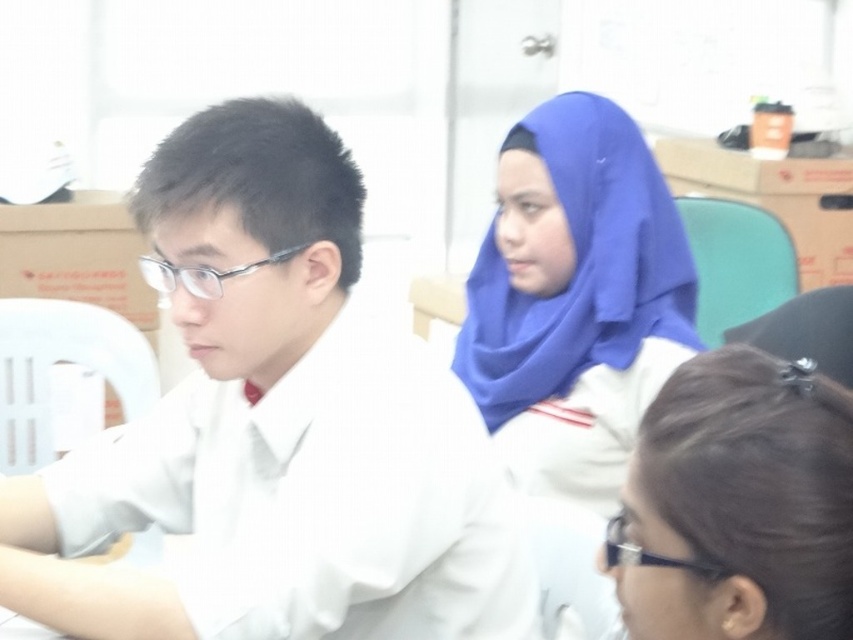
Question: Can you confirm if brown hair at lower right is bigger than blue fabric veil at upper center?

Choices:
 (A) yes
 (B) no

Answer: (B)

Question: Which of the following is the closest to the observer?

Choices:
 (A) (605, 324)
 (B) (730, 444)
 (C) (270, 221)

Answer: (B)

Question: Is brown hair at lower right above blue fabric veil at upper center?

Choices:
 (A) yes
 (B) no

Answer: (B)

Question: Does white matte shirt at left appear on the left side of brown hair at lower right?

Choices:
 (A) yes
 (B) no

Answer: (A)

Question: Which object is positioned farthest from the blue fabric veil at upper center?

Choices:
 (A) white matte shirt at left
 (B) brown hair at lower right

Answer: (B)

Question: Estimate the real-world distances between objects in this image. Which object is closer to the brown hair at lower right?

Choices:
 (A) white matte shirt at left
 (B) blue fabric veil at upper center

Answer: (A)